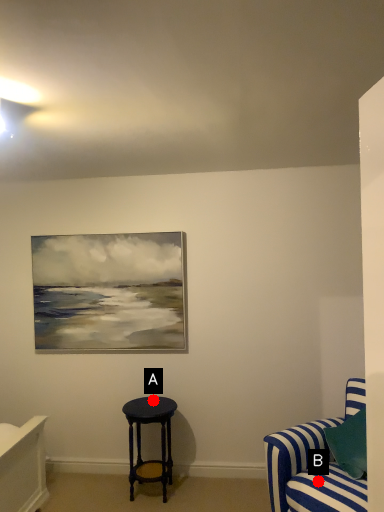
Question: Two points are circled on the image, labeled by A and B beside each circle. Which point appears closest to the camera in this image?

Choices:
 (A) A is closer
 (B) B is closer

Answer: (B)